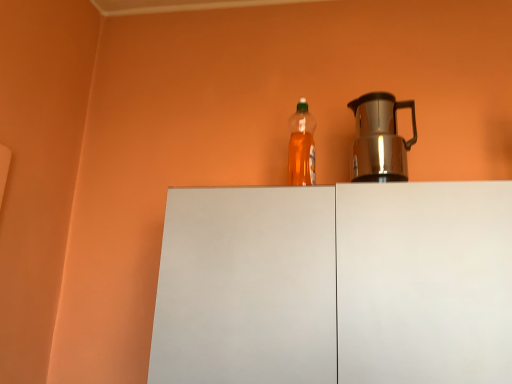
In order to face shiny metallic kettle at right, should I rotate leftwards or rightwards?

Rotate your view right by about 17.148°.

Image resolution: width=512 pixels, height=384 pixels. I want to click on white matte cabinet at center, so click(336, 284).

Where is `cabinetry lying below the shiny metallic kettle at right (from the image's perspective)`? This screenshot has width=512, height=384. cabinetry lying below the shiny metallic kettle at right (from the image's perspective) is located at coordinates (336, 284).

From the image's perspective, does white matte cabinet at center appear lower than shiny metallic kettle at right?

Indeed, from the image's perspective, white matte cabinet at center is shown beneath shiny metallic kettle at right.

Does point (308, 370) appear closer or farther from the camera than point (373, 113)?

Point (308, 370) appears to be closer to the viewer than point (373, 113).

How far apart are white matte cabinet at center and shiny metallic kettle at right?

19.19 inches.

Does white matte cabinet at center have a lesser height compared to translucent plastic bottle at center?

No, white matte cabinet at center is not shorter than translucent plastic bottle at center.

In the image, is white matte cabinet at center positioned in front of or behind translucent plastic bottle at center?

Clearly, white matte cabinet at center is in front of translucent plastic bottle at center.

Which of these two, white matte cabinet at center or translucent plastic bottle at center, is thinner?

translucent plastic bottle at center is thinner.

Identify the location of cabinetry directly beneath the translucent plastic bottle at center (from a real-world perspective). (336, 284).

From a real-world perspective, is shiny metallic kettle at right positioned over translucent plastic bottle at center based on gravity?

No.

This screenshot has width=512, height=384. I want to click on bottle above the shiny metallic kettle at right (from a real-world perspective), so click(301, 147).

Between shiny metallic kettle at right and translucent plastic bottle at center, which one is positioned in front?

shiny metallic kettle at right.

Between shiny metallic kettle at right and translucent plastic bottle at center, which one appears on the right side from the viewer's perspective?

shiny metallic kettle at right.

Can you tell me how much translucent plastic bottle at center and white matte cabinet at center differ in facing direction?

The angular difference between translucent plastic bottle at center and white matte cabinet at center is 0.877 degrees.

From the image's perspective, which one is positioned higher, translucent plastic bottle at center or white matte cabinet at center?

translucent plastic bottle at center is shown above in the image.

Which of these two, translucent plastic bottle at center or white matte cabinet at center, stands shorter?

With less height is translucent plastic bottle at center.

Is translucent plastic bottle at center with white matte cabinet at center?

There is a gap between translucent plastic bottle at center and white matte cabinet at center.

From the picture: Is shiny metallic kettle at right directly adjacent to white matte cabinet at center?

No, shiny metallic kettle at right is not touching white matte cabinet at center.

Is shiny metallic kettle at right oriented away from white matte cabinet at center?

That's not correct — shiny metallic kettle at right is not looking away from white matte cabinet at center.

From the image's perspective, which one is positioned higher, shiny metallic kettle at right or white matte cabinet at center?

shiny metallic kettle at right.

Is white matte cabinet at center completely or partially inside shiny metallic kettle at right?

Actually, white matte cabinet at center is outside shiny metallic kettle at right.

Considering the points (308, 175) and (393, 113), which point is behind, point (308, 175) or point (393, 113)?

The point (393, 113) is farther.

From the image's perspective, which is above, translucent plastic bottle at center or shiny metallic kettle at right?

translucent plastic bottle at center, from the image's perspective.

This screenshot has width=512, height=384. I want to click on kettle below the translucent plastic bottle at center (from a real-world perspective), so click(380, 138).

Considering the relative sizes of translucent plastic bottle at center and shiny metallic kettle at right in the image provided, is translucent plastic bottle at center wider than shiny metallic kettle at right?

No.

The image size is (512, 384). Find the location of `cabinetry below the shiny metallic kettle at right (from the image's perspective)`. cabinetry below the shiny metallic kettle at right (from the image's perspective) is located at coordinates (336, 284).

Locate an element on the screen. bottle that appears above the white matte cabinet at center (from a real-world perspective) is located at coordinates (301, 147).

Considering their positions, is translucent plastic bottle at center positioned closer to white matte cabinet at center than shiny metallic kettle at right?

Based on the image, translucent plastic bottle at center appears to be nearer to white matte cabinet at center.

Based on their spatial positions, is white matte cabinet at center or translucent plastic bottle at center further from shiny metallic kettle at right?

Among the two, white matte cabinet at center is located further to shiny metallic kettle at right.

From the image, which object appears to be nearer to white matte cabinet at center, shiny metallic kettle at right or translucent plastic bottle at center?

translucent plastic bottle at center is closer to white matte cabinet at center.

Looking at the image, which one is located further to translucent plastic bottle at center, white matte cabinet at center or shiny metallic kettle at right?

white matte cabinet at center is positioned further to the anchor translucent plastic bottle at center.

Which object lies further to the anchor point translucent plastic bottle at center, shiny metallic kettle at right or white matte cabinet at center?

white matte cabinet at center lies further to translucent plastic bottle at center than the other object.

Which object lies nearer to the anchor point shiny metallic kettle at right, translucent plastic bottle at center or white matte cabinet at center?

translucent plastic bottle at center lies closer to shiny metallic kettle at right than the other object.

What are the coordinates of `kettle that lies between translucent plastic bottle at center and white matte cabinet at center from top to bottom` in the screenshot? It's located at (380, 138).